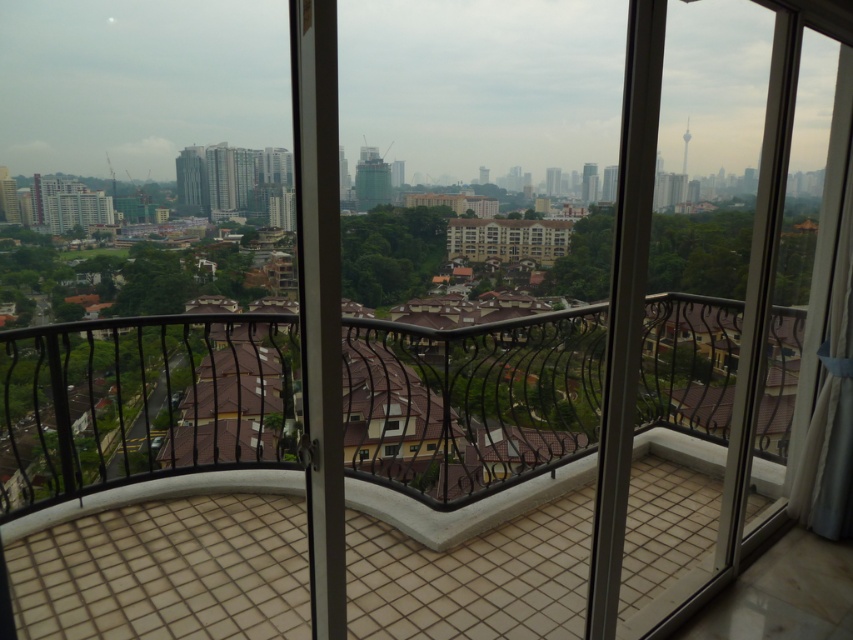
Is brown tile balcony at center taller than transparent glass window at center?

Yes.

Between point (6, 497) and point (393, 448), which one is positioned in front?

Point (6, 497)

Which is in front, point (119, 433) or point (392, 448)?

Positioned in front is point (392, 448).

You are a GUI agent. You are given a task and a screenshot of the screen. Output one action in this format:
    pyautogui.click(x=<x>, y=<y>)
    Task: Click on the brown tile balcony at center
    The image size is (853, 640).
    Given the screenshot: What is the action you would take?
    pyautogui.click(x=140, y=403)